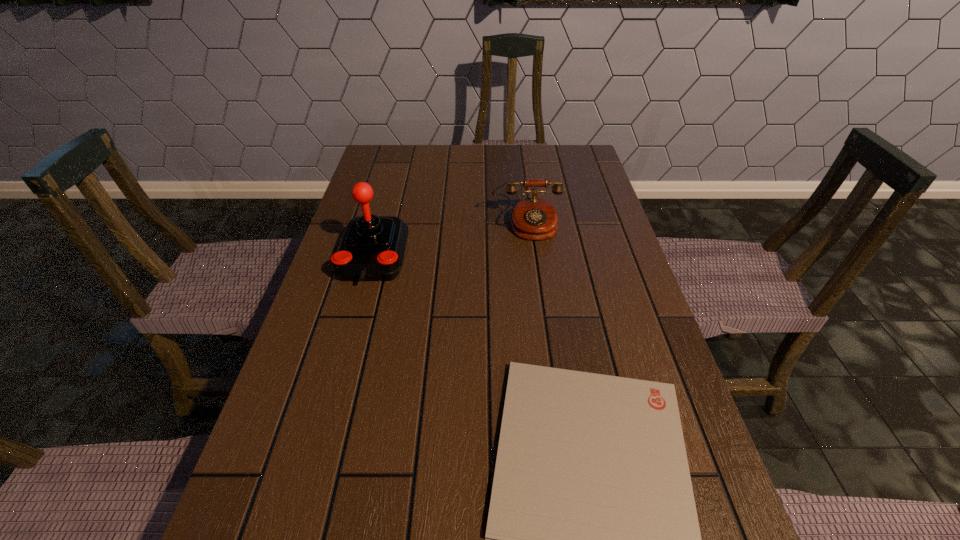
Find the location of `vacant space at the far left corner`. vacant space at the far left corner is located at coordinates (396, 148).

In order to click on free space that is in between the telephone and the leftmost object in this screenshot , I will do `click(450, 242)`.

Locate an element on the screen. This screenshot has width=960, height=540. object that is the second nearest to the second shortest object is located at coordinates (592, 539).

Locate which object is the second closest to the tallest object. Please provide its 2D coordinates. Your answer should be formatted as a tuple, i.e. [(x, y)], where the tuple contains the x and y coordinates of a point satisfying the conditions above.

[(592, 539)]